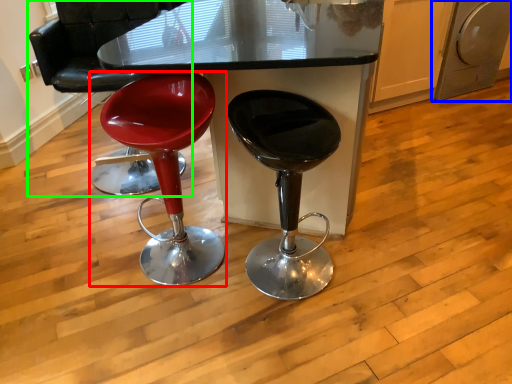
Question: Considering the real-world distances, which object is closest to stool (highlighted by a red box)? dish washer (highlighted by a blue box) or chair (highlighted by a green box).

Choices:
 (A) dish washer
 (B) chair

Answer: (B)